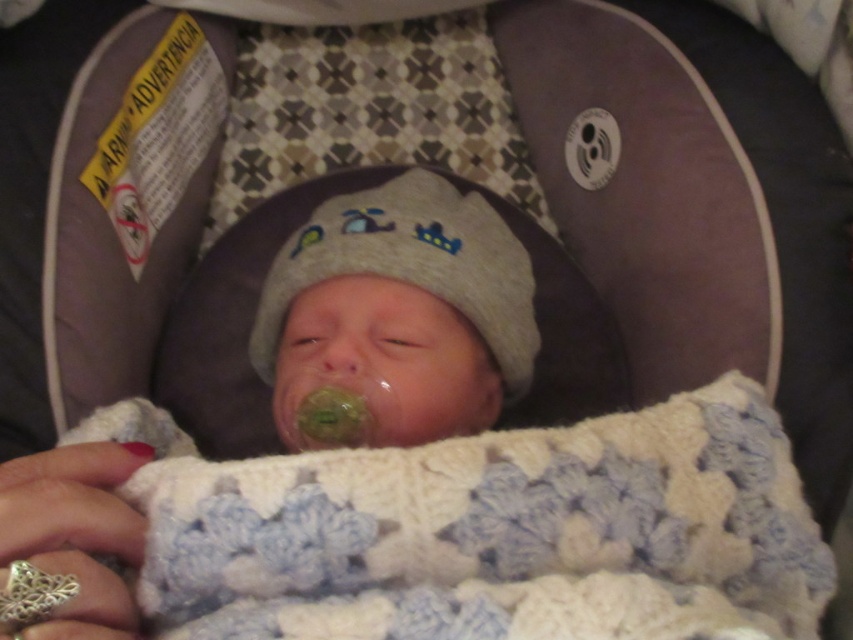
You are a parent checking the car seat for safety. You notice the gray knit hat at center and the silver metallic teething ring at lower left. Which object is larger in size?

The gray knit hat at center is bigger than the silver metallic teething ring at lower left.

You are a parent holding a silver metallic teething ring at lower left and want to give it to your baby in the car seat. Can you hand it directly to the baby without moving the white knitted blanket at center?

The silver metallic teething ring at lower left is behind the white knitted blanket at center, so you cannot hand it directly to the baby without moving the white knitted blanket at center first.

You are a parent checking the car seat for your baby. You notice the gray knit hat at center and the silver metallic teething ring at lower left. Which object is positioned more to the left?

The silver metallic teething ring at lower left is more to the left than the gray knit hat at center.